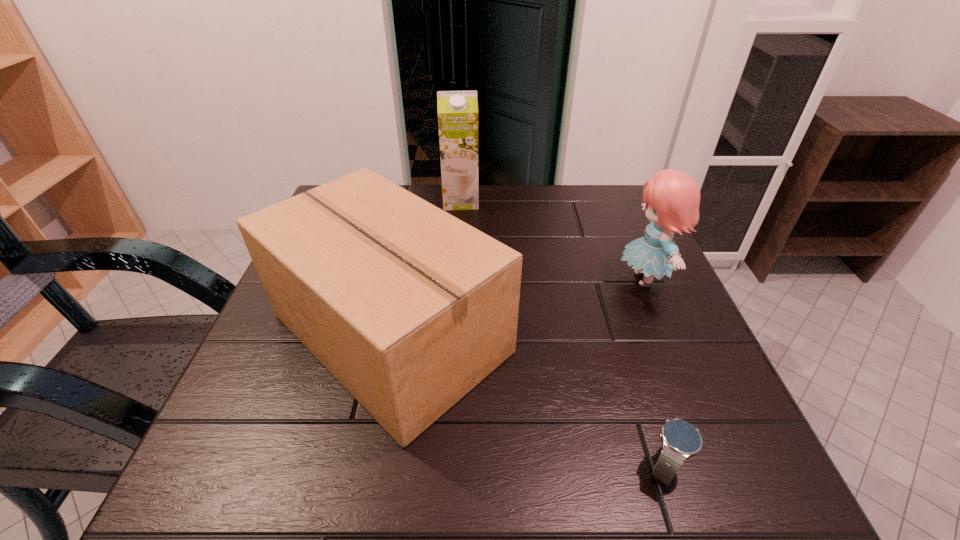
Where is `the farthest object`? The height and width of the screenshot is (540, 960). the farthest object is located at coordinates (457, 111).

Locate an element on the screen. doll is located at coordinates (672, 197).

The height and width of the screenshot is (540, 960). Find the location of `box`. box is located at coordinates (408, 307).

Where is `watch`? The image size is (960, 540). watch is located at coordinates (680, 440).

Identify the location of vacant space located on the front of the soya milk. The image size is (960, 540). (454, 297).

Identify the location of vacant space located 0.320m on the front-facing side of the doll. (472, 279).

Find the location of a particular element. vacant space located 0.280m on the front-facing side of the doll is located at coordinates (490, 279).

This screenshot has width=960, height=540. I want to click on vacant space located 0.070m on the front-facing side of the doll, so click(585, 279).

At what (x,y) coordinates should I click in order to perform the action: click on vacant space situated 0.090m on the back of the box. Please return your answer as a coordinate pair (x, y). This screenshot has height=540, width=960. Looking at the image, I should click on (411, 235).

Image resolution: width=960 pixels, height=540 pixels. What are the coordinates of `vacant space located 0.350m on the left of the watch` in the screenshot? It's located at (407, 465).